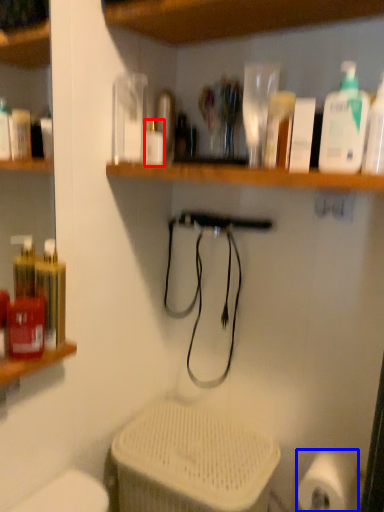
Question: Among these objects, which one is farthest to the camera, bottle (highlighted by a red box) or toilet paper (highlighted by a blue box)?

Choices:
 (A) bottle
 (B) toilet paper

Answer: (A)